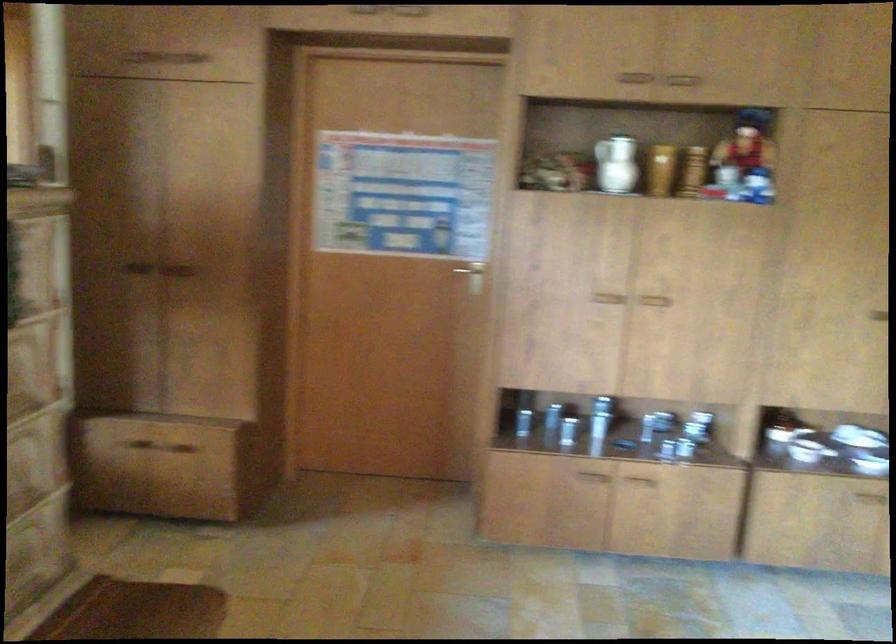
The images are taken continuously from a first-person perspective. In which direction is your viewpoint rotating?

The rotation direction of the camera is right-down.